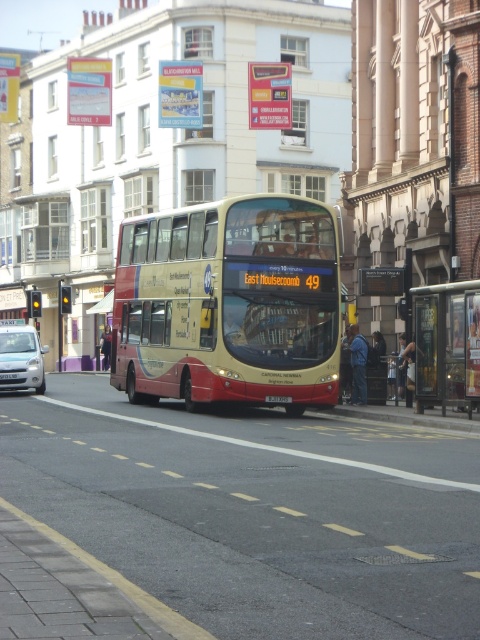
Question: Which object is the farthest from the black plastic license plate at center?

Choices:
 (A) metallic bus stop at right
 (B) white plastic license plate at center

Answer: (B)

Question: Does metallic bus stop at right have a smaller size compared to black plastic license plate at center?

Choices:
 (A) yes
 (B) no

Answer: (B)

Question: Which of the following is the farthest from the observer?

Choices:
 (A) metallic bus stop at right
 (B) white plastic license plate at center
 (C) beige metallic bus at center

Answer: (B)

Question: Is metallic bus stop at right thinner than silver metallic car at left?

Choices:
 (A) no
 (B) yes

Answer: (B)

Question: Which point is closer to the camera?

Choices:
 (A) (0, 374)
 (B) (446, 323)

Answer: (B)

Question: Is beige metallic bus at center thinner than black plastic license plate at center?

Choices:
 (A) no
 (B) yes

Answer: (A)